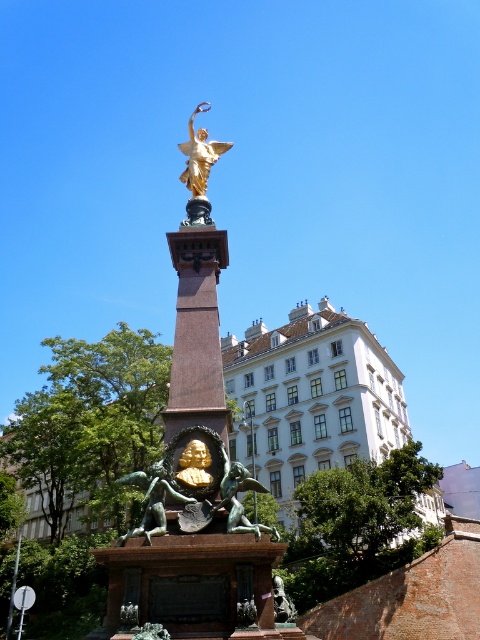
You are standing at the entrance of the public square and want to take a photo of the gold polished statue at center. Where should you position yourself to ensure the statue is centered in your camera frame?

The gold polished statue at center is located at coordinates point [194,486], so you should position yourself directly in front of that point to center it in your camera frame.

You are standing in the park and see the monument. There is a point at coordinate (194, 486). Where is this point located?

The point at coordinate (194, 486) is located on the gold polished statue at center.